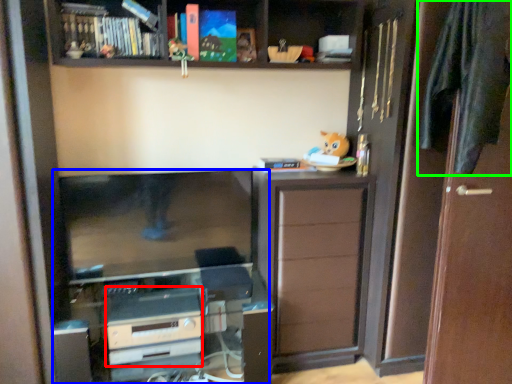
Question: Which object is the closest to the appliance (highlighted by a red box)? Choose among these: entertainment center (highlighted by a blue box) or clothe (highlighted by a green box).

Choices:
 (A) entertainment center
 (B) clothe

Answer: (A)